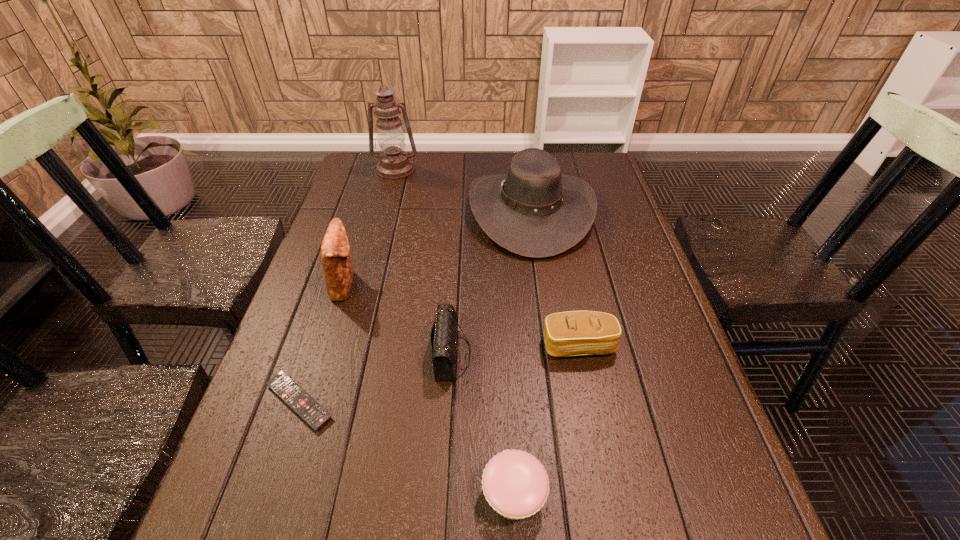
Image resolution: width=960 pixels, height=540 pixels. Find the location of `object present at the near edge`. object present at the near edge is located at coordinates (515, 484).

Image resolution: width=960 pixels, height=540 pixels. I want to click on oil lamp that is at the left edge, so click(394, 163).

Where is `clutch bag present at the left edge`? This screenshot has height=540, width=960. clutch bag present at the left edge is located at coordinates (338, 271).

Find the location of a particular element. This screenshot has height=540, width=960. remote control that is at the left edge is located at coordinates (288, 390).

I want to click on cowboy hat situated at the right edge, so click(x=533, y=211).

Where is `clutch bag positioned at the right edge`? clutch bag positioned at the right edge is located at coordinates (572, 333).

Where is `object located in the far left corner section of the desktop`? Image resolution: width=960 pixels, height=540 pixels. object located in the far left corner section of the desktop is located at coordinates (394, 163).

Locate an element on the screen. The image size is (960, 540). object situated at the far right corner is located at coordinates (533, 211).

Image resolution: width=960 pixels, height=540 pixels. Identify the location of free space at the far edge. (488, 160).

Locate an element on the screen. This screenshot has height=540, width=960. free location at the left edge is located at coordinates (320, 301).